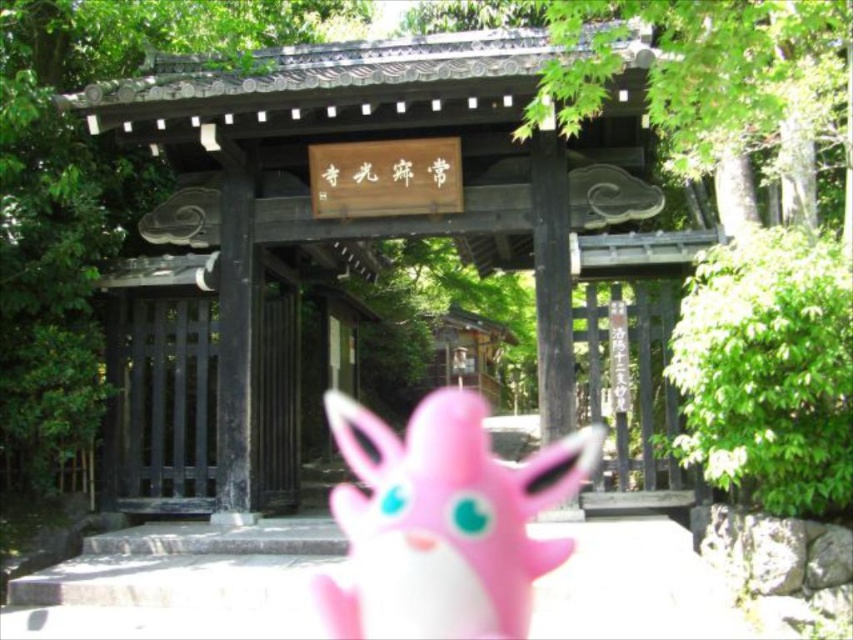
You are a visitor at the temple and see the pink rubber toy at center and the black wooden gate at center. Which object is bigger in size?

The pink rubber toy at center is larger in size compared to the black wooden gate at center.

You are a visitor at the temple and see the pink rubber toy at center and the black wooden gate at center. Which object is closer to the ground?

The pink rubber toy at center is closer to the ground because it is below the black wooden gate at center.

You are standing at the traditional Japanese gate and want to place a small offering at the point closer to the entrance. Which point should you choose between point [520,544] and point [204,344]?

Point [204,344] is closer to the entrance because it is behind point [520,544], which is in front of it.